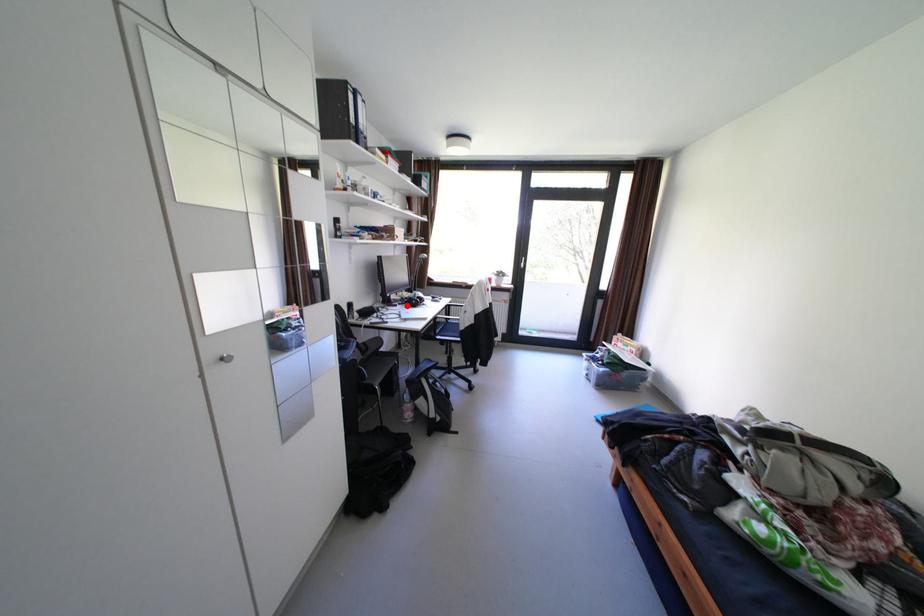
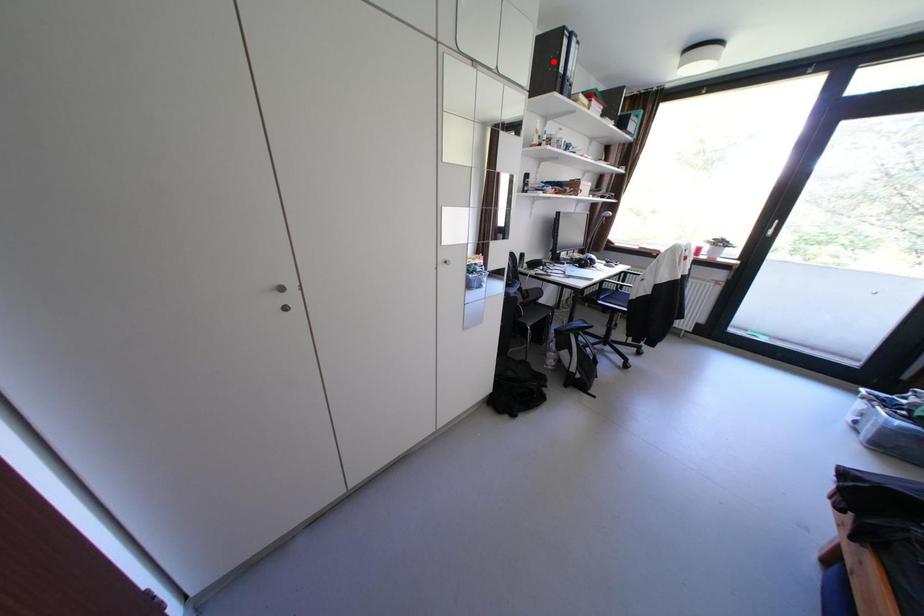
I am providing you with two images of the same scene from different viewpoints. A red point is marked on the first image and another point is marked on the second image. Do the highlighted points in image1 and image2 indicate the same real-world spot?

No